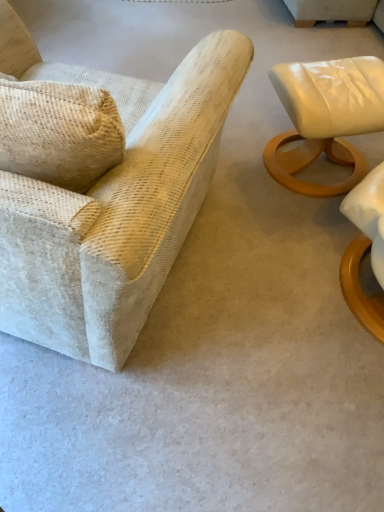
Question: Is textured beige armchair at left, arranged as the 1th chair when viewed from the left, oriented away from matte white leather ottoman at right, positioned as the 1th chair in right-to-left order?

Choices:
 (A) yes
 (B) no

Answer: (B)

Question: From a real-world perspective, is textured beige armchair at left, arranged as the 1th chair when viewed from the left, under matte white leather ottoman at right, the second chair viewed from the left?

Choices:
 (A) yes
 (B) no

Answer: (B)

Question: Can you see textured beige armchair at left, which appears as the second chair when viewed from the right, touching matte white leather ottoman at right, the second chair viewed from the left?

Choices:
 (A) no
 (B) yes

Answer: (A)

Question: Is textured beige armchair at left, arranged as the 1th chair when viewed from the left, far away from matte white leather ottoman at right, positioned as the 1th chair in right-to-left order?

Choices:
 (A) no
 (B) yes

Answer: (A)

Question: Does textured beige armchair at left, which appears as the second chair when viewed from the right, have a larger size compared to matte white leather ottoman at right, the second chair viewed from the left?

Choices:
 (A) yes
 (B) no

Answer: (A)

Question: Is textured beige armchair at left, arranged as the 1th chair when viewed from the left, oriented towards matte white leather ottoman at right, positioned as the 1th chair in right-to-left order?

Choices:
 (A) yes
 (B) no

Answer: (B)

Question: From a real-world perspective, is matte white leather ottoman at right, positioned as the 1th chair in right-to-left order, physically below textured beige armchair at left, arranged as the 1th chair when viewed from the left?

Choices:
 (A) yes
 (B) no

Answer: (A)

Question: Does matte white leather ottoman at right, the second chair viewed from the left, lie behind textured beige armchair at left, arranged as the 1th chair when viewed from the left?

Choices:
 (A) yes
 (B) no

Answer: (A)

Question: Is the position of matte white leather ottoman at right, the second chair viewed from the left, less distant than that of textured beige armchair at left, arranged as the 1th chair when viewed from the left?

Choices:
 (A) no
 (B) yes

Answer: (A)

Question: Does matte white leather ottoman at right, positioned as the 1th chair in right-to-left order, have a greater height compared to textured beige armchair at left, arranged as the 1th chair when viewed from the left?

Choices:
 (A) yes
 (B) no

Answer: (B)

Question: Does matte white leather ottoman at right, positioned as the 1th chair in right-to-left order, have a lesser width compared to textured beige armchair at left, arranged as the 1th chair when viewed from the left?

Choices:
 (A) yes
 (B) no

Answer: (A)

Question: Is matte white leather ottoman at right, the second chair viewed from the left, wider than textured beige armchair at left, arranged as the 1th chair when viewed from the left?

Choices:
 (A) yes
 (B) no

Answer: (B)

Question: Considering the relative positions of matte white leather ottoman at right, the second chair viewed from the left, and textured beige armchair at left, which appears as the second chair when viewed from the right, in the image provided, is matte white leather ottoman at right, the second chair viewed from the left, to the left or to the right of textured beige armchair at left, which appears as the second chair when viewed from the right,?

Choices:
 (A) right
 (B) left

Answer: (A)